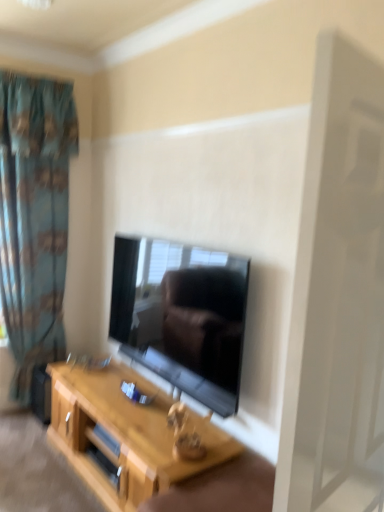
I want to click on free spot above light wood table at center (from a real-world perspective), so (130, 396).